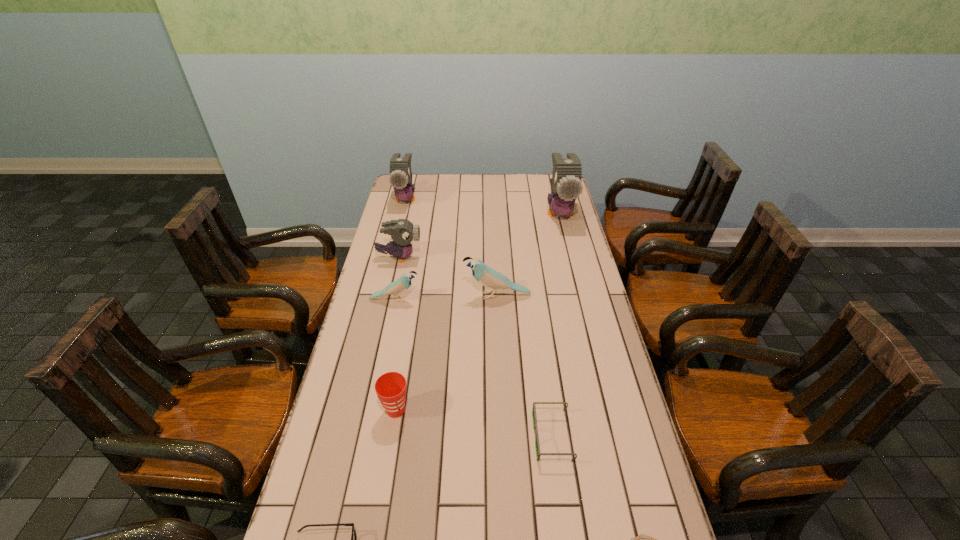
Image resolution: width=960 pixels, height=540 pixels. In order to click on cup in this screenshot , I will do `click(390, 387)`.

This screenshot has width=960, height=540. I want to click on the right spectacles, so click(x=538, y=453).

This screenshot has height=540, width=960. What are the coordinates of `the farther spectacles` in the screenshot? It's located at (538, 453).

Identify the location of free spot located 0.090m at the beak of the tallest object. point(567,245).

Locate an element on the screen. free space located 0.310m at the beak of the second smallest gray bird is located at coordinates (393, 255).

Find the location of `free spot located at the face of the second bird from right to left`. free spot located at the face of the second bird from right to left is located at coordinates (378, 295).

Where is `free space located 0.300m at the face of the second bird from right to left`? free space located 0.300m at the face of the second bird from right to left is located at coordinates (381, 295).

Locate an element on the screen. The width and height of the screenshot is (960, 540). vacant space located 0.330m at the face of the second bird from right to left is located at coordinates (372, 295).

This screenshot has height=540, width=960. What are the coordinates of `free region located 0.310m at the beak of the nearest gray bird` in the screenshot? It's located at (499, 258).

This screenshot has width=960, height=540. Identify the location of vacant region located at the face of the smaller blue bird. (532, 300).